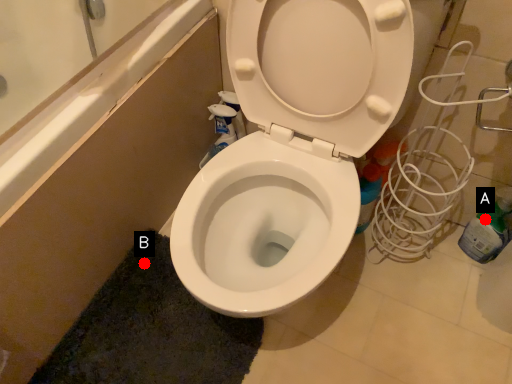
Question: Two points are circled on the image, labeled by A and B beside each circle. Which point is farther from the camera taking this photo?

Choices:
 (A) A is further
 (B) B is further

Answer: (B)